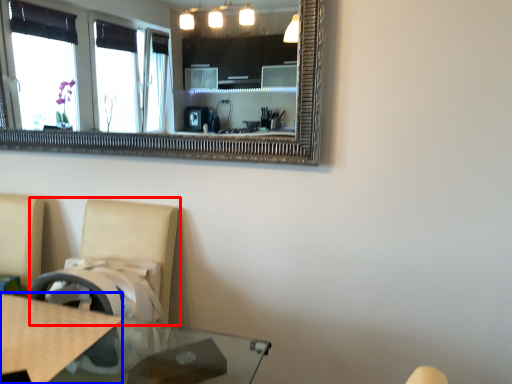
Question: Which point is further to the camera, swivel chair (highlighted by a red box) or counter top (highlighted by a blue box)?

Choices:
 (A) swivel chair
 (B) counter top

Answer: (A)